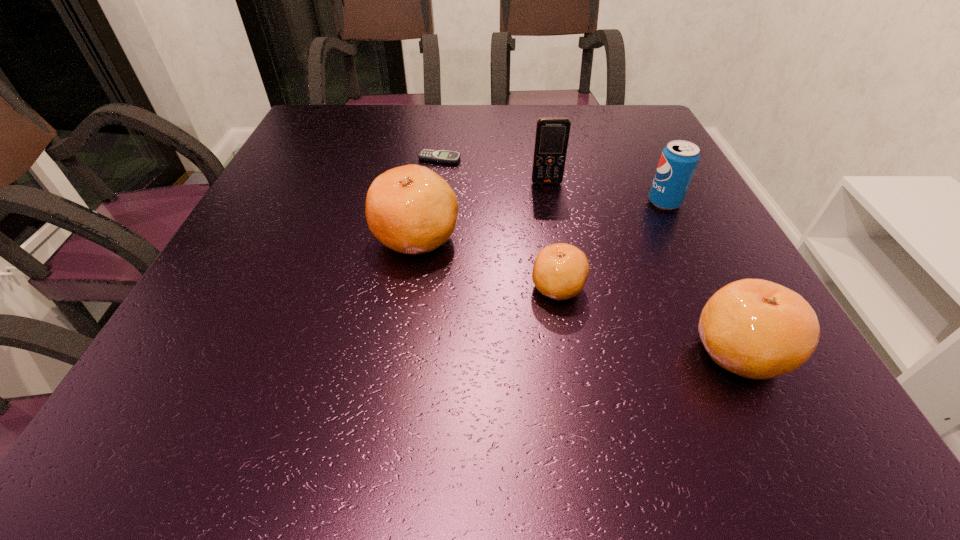
This screenshot has width=960, height=540. Identify the location of the leftmost clementine. (410, 209).

Locate an element on the screen. This screenshot has width=960, height=540. the shortest clementine is located at coordinates (560, 271).

Locate an element on the screen. The width and height of the screenshot is (960, 540). the second nearest object is located at coordinates (560, 271).

The image size is (960, 540). Identify the location of the second shortest clementine. (754, 328).

The height and width of the screenshot is (540, 960). I want to click on the nearest clementine, so [754, 328].

Where is `the second farthest object`? the second farthest object is located at coordinates (552, 134).

Where is `soda can`? The image size is (960, 540). soda can is located at coordinates (679, 159).

Locate an element on the screen. Image resolution: width=960 pixels, height=540 pixels. the farthest object is located at coordinates click(440, 156).

What are the coordinates of `the shortest object` in the screenshot? It's located at (440, 156).

What are the coordinates of `vacant space located on the front of the farthest clementine` in the screenshot? It's located at point(406,303).